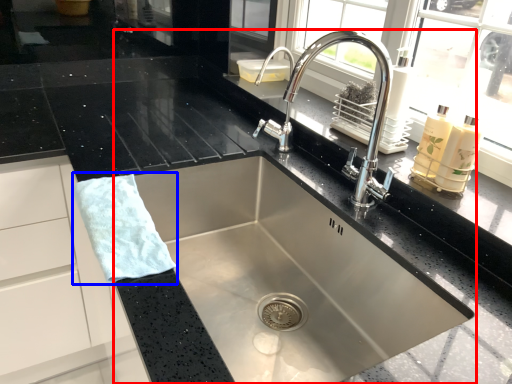
Question: Which object is closer to the camera taking this photo, sink (highlighted by a red box) or hand towel (highlighted by a blue box)?

Choices:
 (A) sink
 (B) hand towel

Answer: (A)